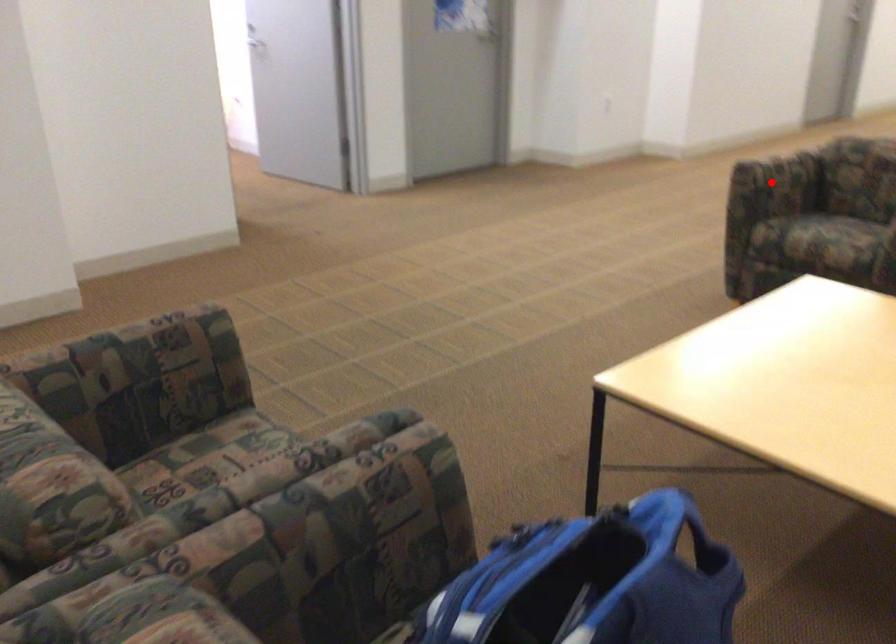
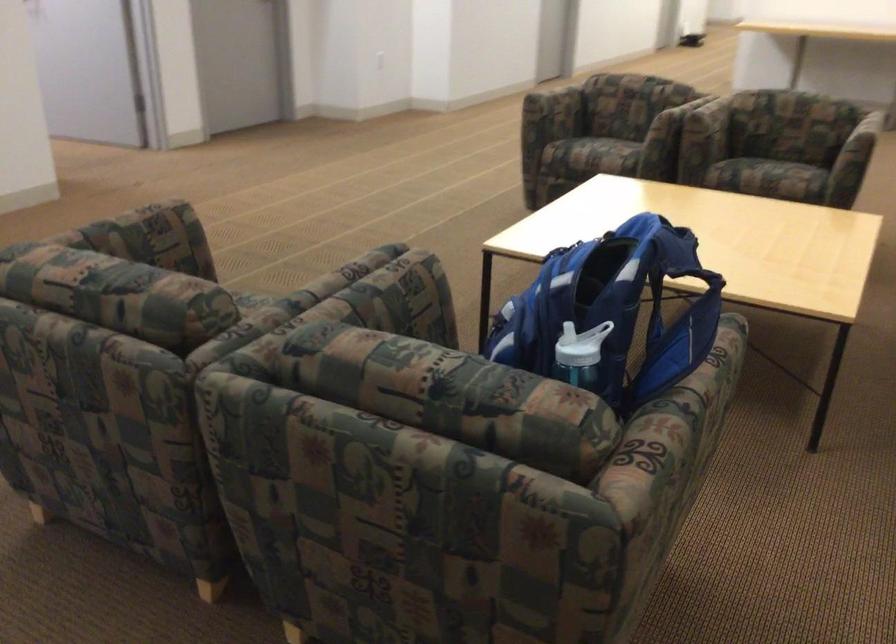
Find the pixel in the second image that matches the highlighted location in the first image.

(554, 108)